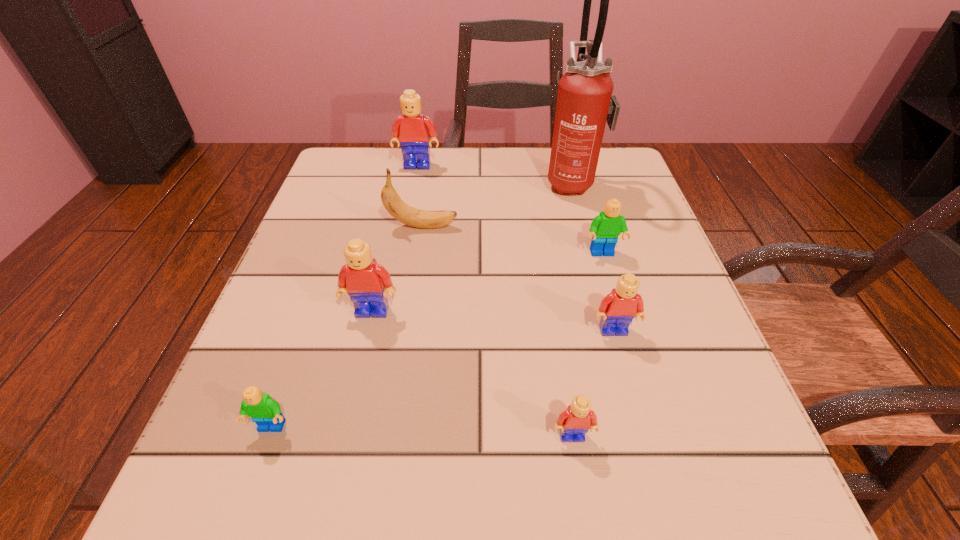
The height and width of the screenshot is (540, 960). Find the location of `free location located at the start of the peel on the sixth nearest object`. free location located at the start of the peel on the sixth nearest object is located at coordinates (575, 226).

This screenshot has height=540, width=960. Identify the location of free spot located on the front-facing side of the second nearest yellow Lego. (634, 407).

Locate an element on the screen. blank space located on the face of the farther green Lego is located at coordinates (636, 369).

The image size is (960, 540). Identify the location of vacant region located 0.070m on the front-facing side of the nearest yellow Lego. (582, 501).

The height and width of the screenshot is (540, 960). I want to click on free region located 0.080m on the face of the left green Lego, so click(246, 502).

Locate an element on the screen. The width and height of the screenshot is (960, 540). fire extinguisher located at the far edge is located at coordinates (585, 103).

The height and width of the screenshot is (540, 960). In order to click on Lego present at the far edge in this screenshot , I will do `click(412, 129)`.

At what (x,y) coordinates should I click in order to perform the action: click on fire extinguisher present at the right edge. Please return your answer as a coordinate pair (x, y). The width and height of the screenshot is (960, 540). Looking at the image, I should click on (585, 103).

Find the location of `object that is at the far left corner`. object that is at the far left corner is located at coordinates (412, 129).

Where is `object situated at the far right corner`? Image resolution: width=960 pixels, height=540 pixels. object situated at the far right corner is located at coordinates (585, 103).